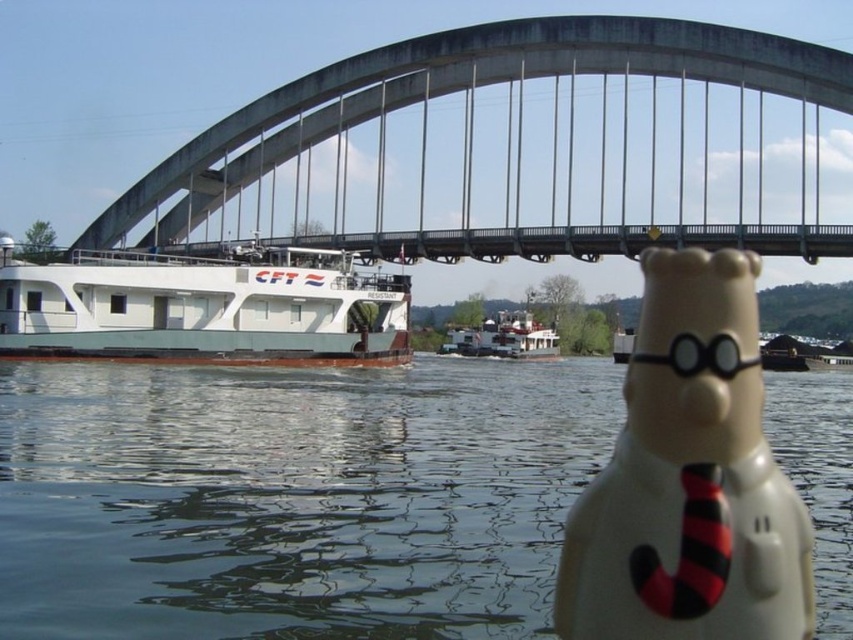
Question: Is white plastic figurine at center to the left of white matte barge at center from the viewer's perspective?

Choices:
 (A) yes
 (B) no

Answer: (B)

Question: Is transparent water at center smaller than white matte barge at left?

Choices:
 (A) yes
 (B) no

Answer: (B)

Question: Considering the relative positions of white plastic figurine at center and white matte barge at left in the image provided, where is white plastic figurine at center located with respect to white matte barge at left?

Choices:
 (A) above
 (B) below

Answer: (B)

Question: Which object is farther from the camera taking this photo?

Choices:
 (A) white plastic figurine at center
 (B) transparent water at center

Answer: (B)

Question: Which point is farther from the camera taking this photo?

Choices:
 (A) (310, 358)
 (B) (766, 92)
 (C) (741, 435)
 (D) (457, 349)

Answer: (D)

Question: Based on their relative distances, which object is farther from the white matte barge at left?

Choices:
 (A) white matte barge at center
 (B) concrete bridge at upper center

Answer: (A)